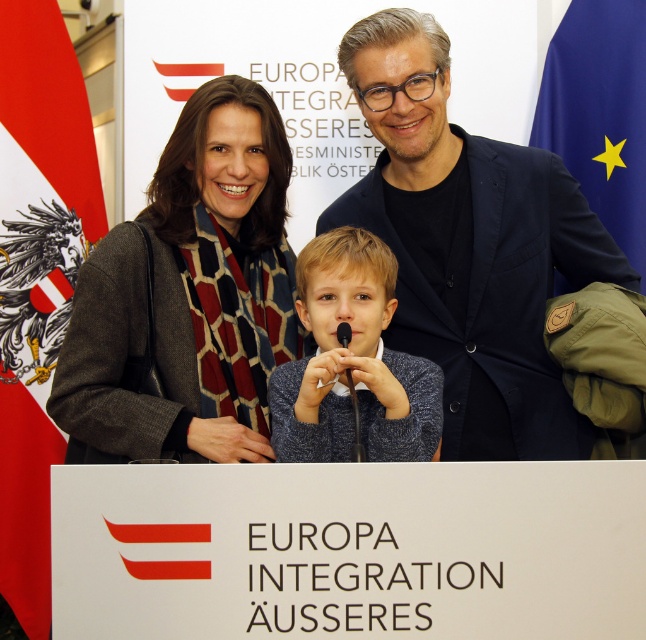
Is dark blue textured blazer at center thinner than black matte microphone at center?

In fact, dark blue textured blazer at center might be wider than black matte microphone at center.

Looking at this image, is the position of dark blue textured blazer at center less distant than that of black matte microphone at center?

No, it is not.

What do you see at coordinates (470, 248) in the screenshot? This screenshot has width=646, height=640. I see `dark blue textured blazer at center` at bounding box center [470, 248].

Where is `dark blue textured blazer at center`? dark blue textured blazer at center is located at coordinates (470, 248).

Is dark gray wool coat at center bigger than red-white fabric flag at left?

Indeed, dark gray wool coat at center has a larger size compared to red-white fabric flag at left.

Between dark gray wool coat at center and red-white fabric flag at left, which one is positioned higher?

Positioned higher is red-white fabric flag at left.

Locate an element on the screen. Image resolution: width=646 pixels, height=640 pixels. dark gray wool coat at center is located at coordinates (185, 291).

Between dark gray wool coat at center and knitted sweater at center, which one is positioned lower?

knitted sweater at center

Looking at this image, who is more distant from viewer, (78, 404) or (287, 440)?

The point (78, 404) is more distant.

The image size is (646, 640). What are the coordinates of `dark gray wool coat at center` in the screenshot? It's located at (185, 291).